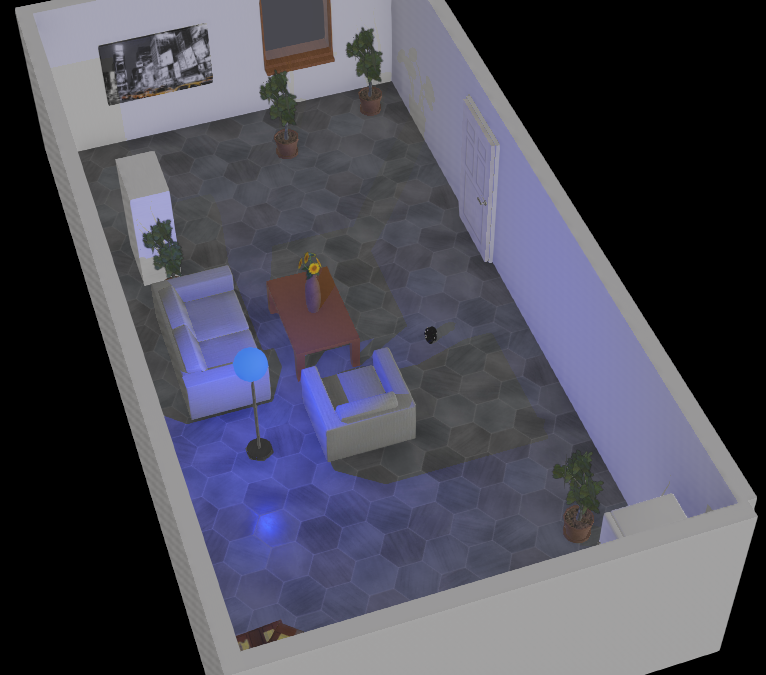
This screenshot has height=675, width=766. I want to click on bookcase, so click(647, 516), click(139, 175).